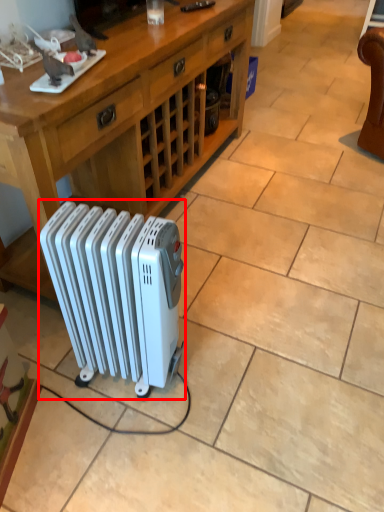
Question: Observing the image, what is the correct spatial positioning of radiator (annotated by the red box) in reference to desk?

Choices:
 (A) right
 (B) left

Answer: (A)